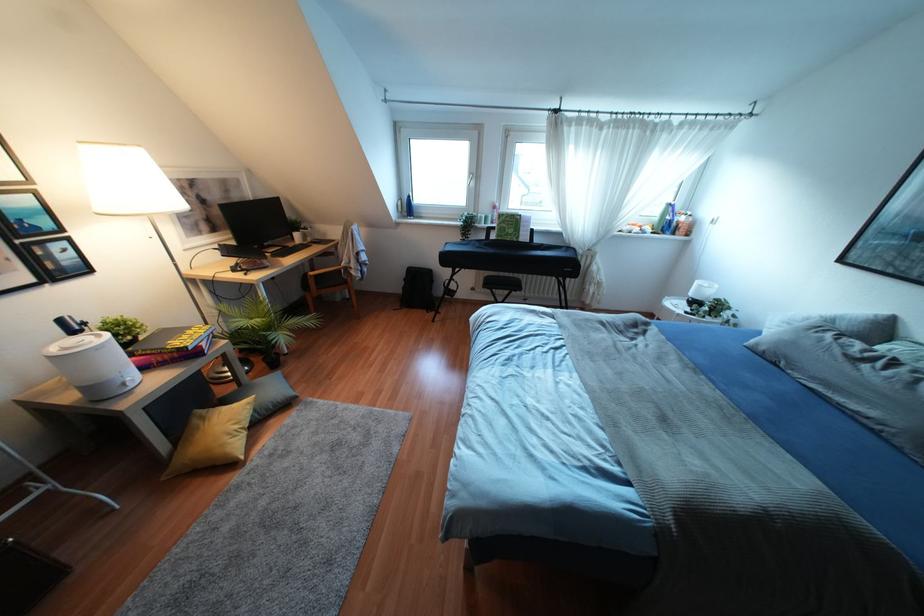
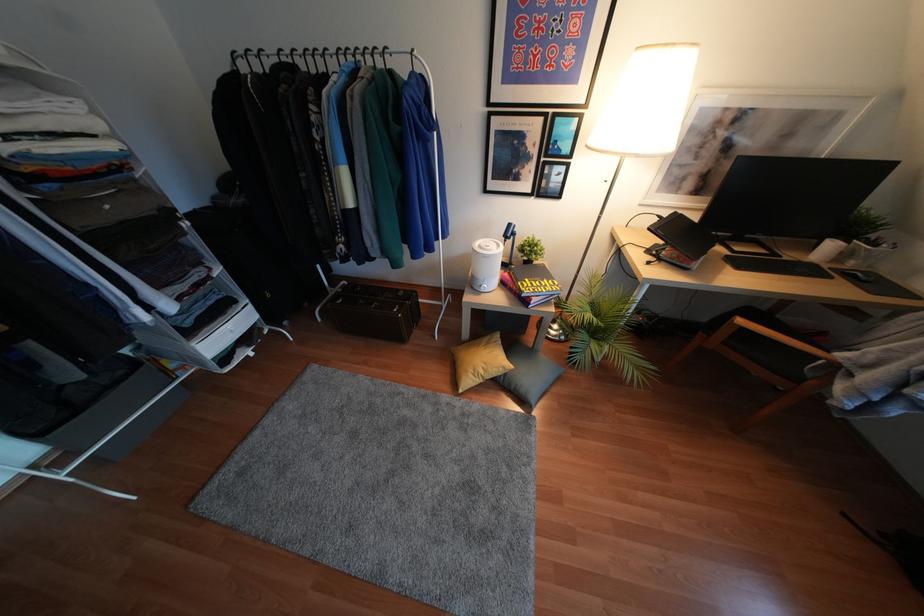
Locate, in the second image, the point that corresponds to point 310,273 in the first image.

(739, 321)